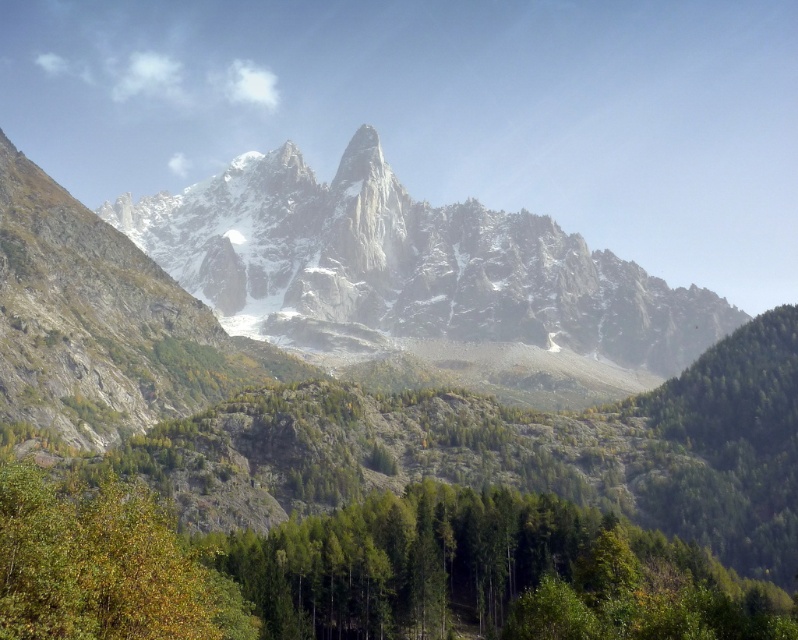
You are standing at the camera position and want to reach the point marked at coordinates point (370, 266). If your walking speed is 5 km per hour, how long would it take you to reach that point?

The distance between you and the point (370, 266) is 251.10 meters. At a walking speed of 5 km per hour, it would take approximately 5.42 minutes to reach the point.

From the picture: You are a hiker planning to take a photo of the white rocky mountain range at center and the green leafy tree at lower left. Which object will appear wider in your camera viewfinder?

The white rocky mountain range at center will appear wider in the camera viewfinder because its width is larger than that of the green leafy tree at lower left.